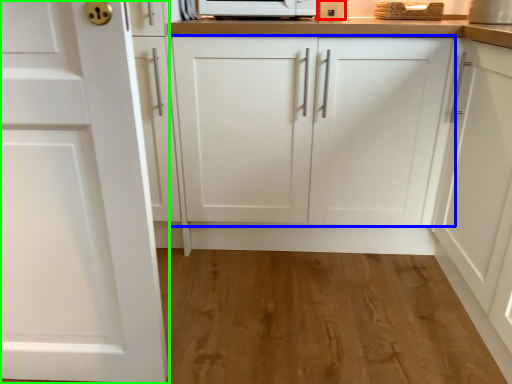
Question: Based on their relative distances, which object is farther from appliance (highlighted by a red box)? Choose from cabinetry (highlighted by a blue box) and cabinetry (highlighted by a green box).

Choices:
 (A) cabinetry
 (B) cabinetry

Answer: (B)